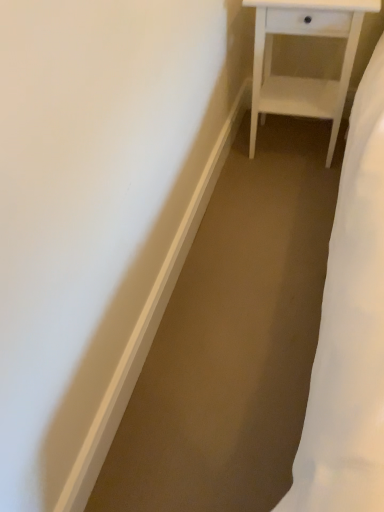
What is the approximate height of white matte nightstand at upper right?

white matte nightstand at upper right is 27.20 inches in height.

Find the location of a particular element. This screenshot has height=512, width=384. white matte nightstand at upper right is located at coordinates (302, 77).

Describe the element at coordinates (302, 77) in the screenshot. I see `white matte nightstand at upper right` at that location.

This screenshot has width=384, height=512. I want to click on white matte nightstand at upper right, so click(302, 77).